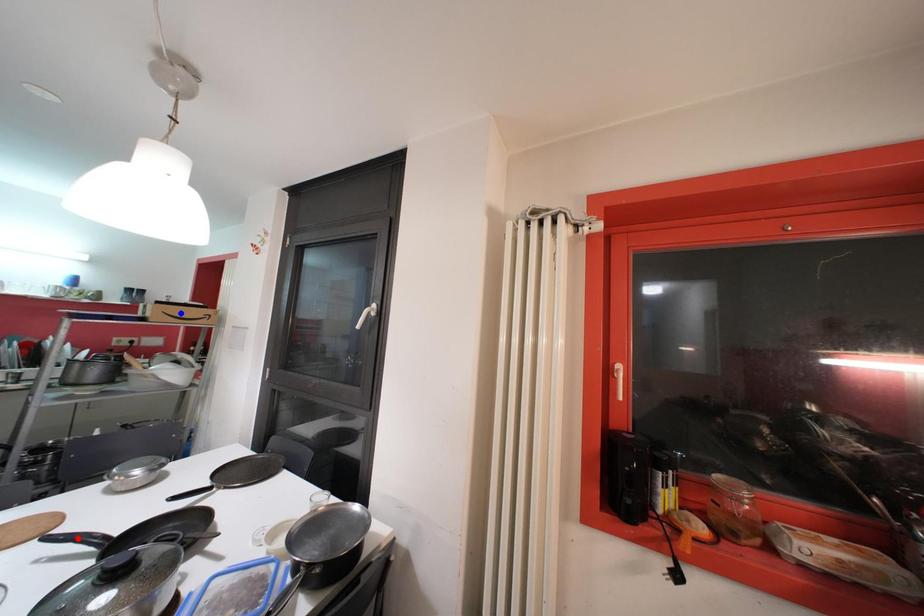
Question: Which of the two points in the image is closer to the camera?

Choices:
 (A) Blue point is closer.
 (B) Red point is closer.

Answer: (B)